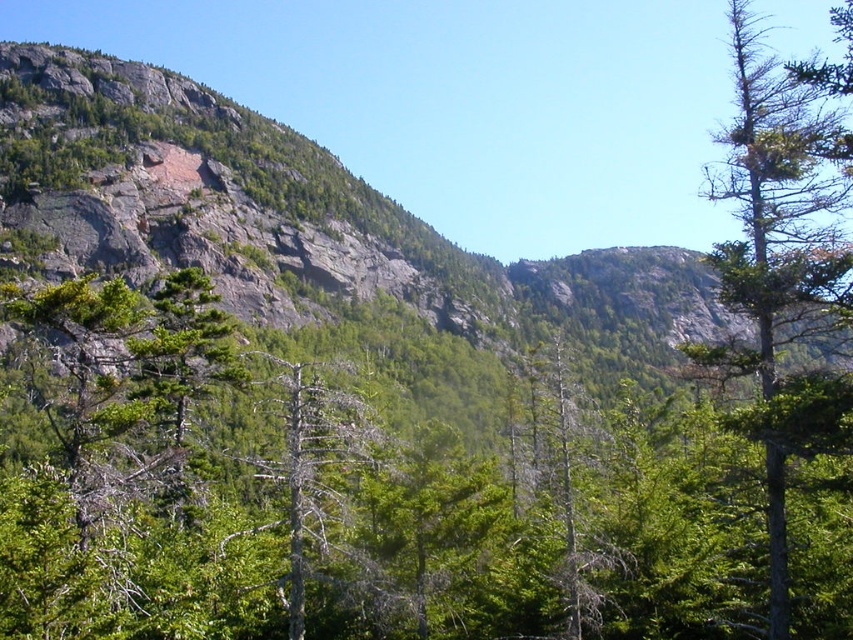
Question: Does green leafy tree at center appear on the right side of green needle-like at right?

Choices:
 (A) yes
 (B) no

Answer: (B)

Question: In this image, where is green leafy tree at center located relative to green needle-like at right?

Choices:
 (A) below
 (B) above

Answer: (A)

Question: Is green leafy tree at center bigger than green needle-like at right?

Choices:
 (A) yes
 (B) no

Answer: (B)

Question: Which of the following is the closest to the observer?

Choices:
 (A) (376, 624)
 (B) (351, 396)
 (C) (798, 104)

Answer: (A)

Question: Which object appears farthest from the camera in this image?

Choices:
 (A) gray bark tree at center
 (B) green leafy tree at center
 (C) green needle-like at right

Answer: (A)

Question: Which object is closer to the camera taking this photo?

Choices:
 (A) green leafy tree at center
 (B) green needle-like at right

Answer: (A)